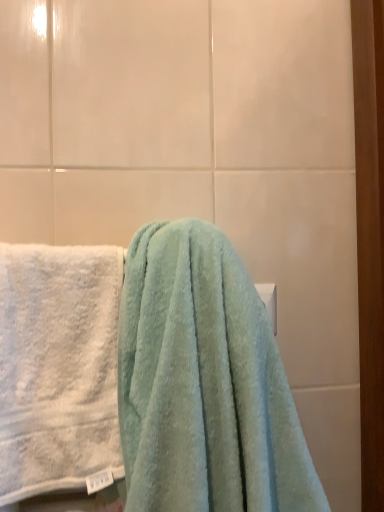
Question: Considering the relative sizes of white fluffy towel at left, which is the first towel from left to right, and white matte towel bar at upper center in the image provided, is white fluffy towel at left, which is the first towel from left to right, shorter than white matte towel bar at upper center?

Choices:
 (A) yes
 (B) no

Answer: (B)

Question: Is the depth of white fluffy towel at left, which is the first towel from left to right, greater than that of white matte towel bar at upper center?

Choices:
 (A) yes
 (B) no

Answer: (B)

Question: Is white fluffy towel at left, which is the first towel from left to right, beside white matte towel bar at upper center?

Choices:
 (A) yes
 (B) no

Answer: (B)

Question: Is white fluffy towel at left, the second towel when ordered from right to left, positioned before white matte towel bar at upper center?

Choices:
 (A) no
 (B) yes

Answer: (B)

Question: Is white fluffy towel at left, the second towel when ordered from right to left, facing towards white matte towel bar at upper center?

Choices:
 (A) yes
 (B) no

Answer: (B)

Question: Considering the positions of white fluffy towel at left, the second towel when ordered from right to left, and white matte towel bar at upper center in the image, is white fluffy towel at left, the second towel when ordered from right to left, taller or shorter than white matte towel bar at upper center?

Choices:
 (A) short
 (B) tall

Answer: (B)

Question: Considering the positions of white fluffy towel at left, the second towel when ordered from right to left, and white matte towel bar at upper center in the image, is white fluffy towel at left, the second towel when ordered from right to left, wider or thinner than white matte towel bar at upper center?

Choices:
 (A) thin
 (B) wide

Answer: (B)

Question: Is white fluffy towel at left, the second towel when ordered from right to left, to the left or to the right of white matte towel bar at upper center in the image?

Choices:
 (A) right
 (B) left

Answer: (B)

Question: Would you say white fluffy towel at left, which is the first towel from left to right, is inside or outside white matte towel bar at upper center?

Choices:
 (A) outside
 (B) inside

Answer: (A)

Question: Is white matte towel bar at upper center in front of or behind white fluffy towel at left, which is the first towel from left to right, in the image?

Choices:
 (A) front
 (B) behind

Answer: (B)

Question: Based on their sizes in the image, would you say white matte towel bar at upper center is bigger or smaller than white fluffy towel at left, the second towel when ordered from right to left?

Choices:
 (A) big
 (B) small

Answer: (B)

Question: Considering the positions of point (269, 291) and point (107, 330), is point (269, 291) closer or farther from the camera than point (107, 330)?

Choices:
 (A) farther
 (B) closer

Answer: (A)

Question: In the image, is white matte towel bar at upper center on the left side or the right side of white fluffy towel at left, the second towel when ordered from right to left?

Choices:
 (A) left
 (B) right

Answer: (B)

Question: Is point (264, 437) positioned closer to the camera than point (269, 293)?

Choices:
 (A) farther
 (B) closer

Answer: (B)

Question: In terms of width, does soft blue towel at center, the 2th towel viewed from the left, look wider or thinner when compared to white matte towel bar at upper center?

Choices:
 (A) wide
 (B) thin

Answer: (A)